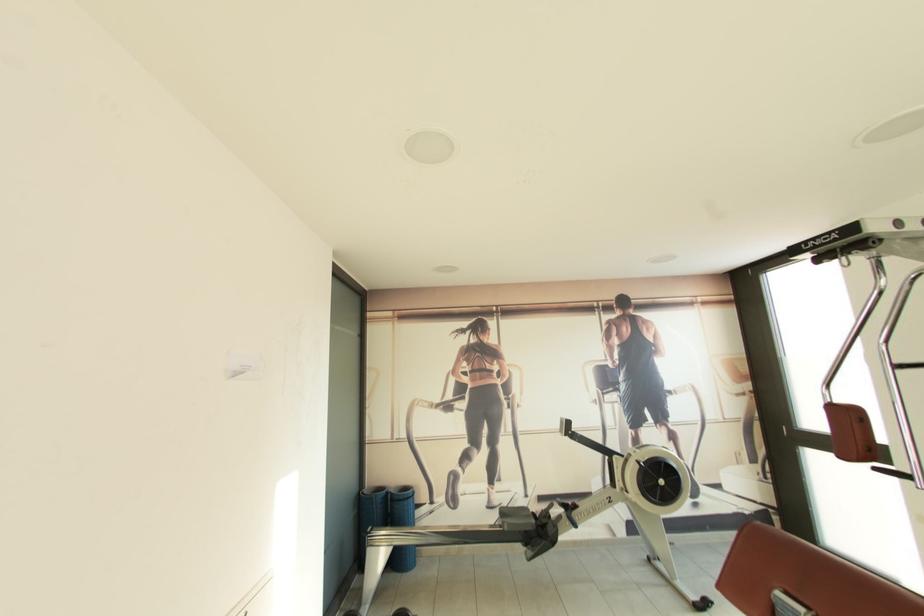
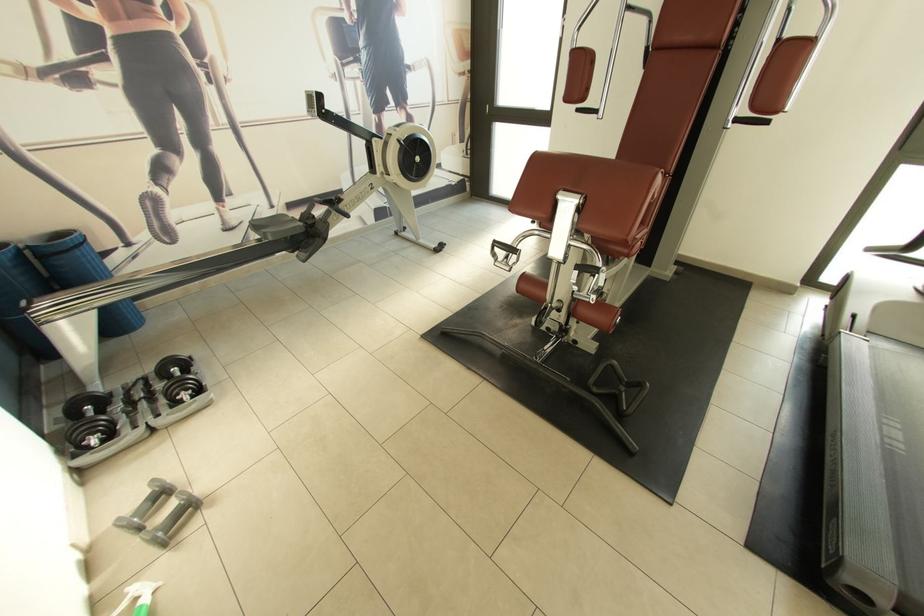
The point at [508,514] is marked in the first image. Where is the corresponding point in the second image?

(262, 227)